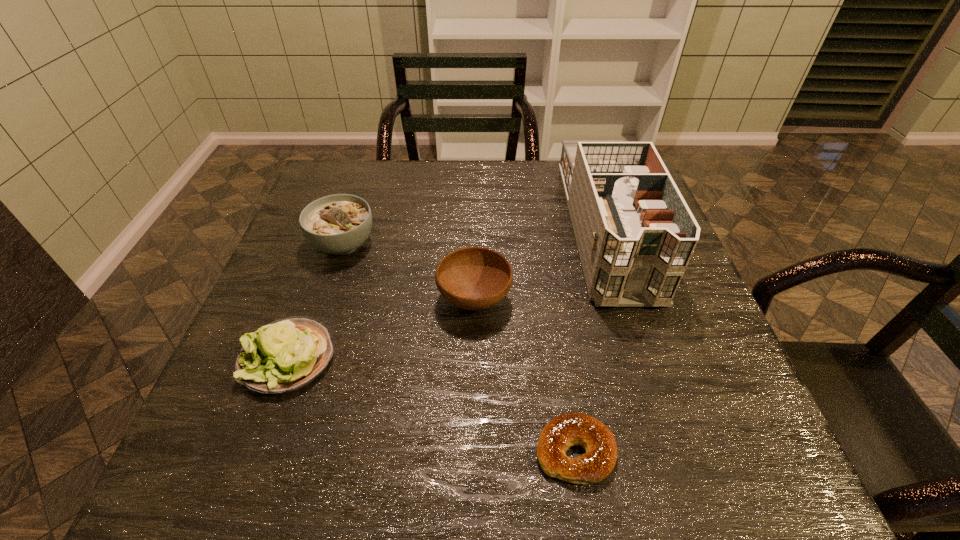
Image resolution: width=960 pixels, height=540 pixels. In order to click on unoccupied area between the tallest object and the fourth object from left to right in this screenshot , I will do `click(590, 340)`.

In order to click on unoccupied position between the soup bowl and the tallest object in this screenshot , I will do `click(474, 236)`.

The height and width of the screenshot is (540, 960). In order to click on free point between the lettuce and the bowl in this screenshot , I will do `click(382, 328)`.

Where is `vacant area that lies between the soup bowl and the bagel`? Image resolution: width=960 pixels, height=540 pixels. vacant area that lies between the soup bowl and the bagel is located at coordinates (459, 347).

Find the location of a particular element. This screenshot has height=540, width=960. object that is the third nearest to the second shortest object is located at coordinates point(570,429).

Point out which object is positioned as the third nearest to the bowl. Please provide its 2D coordinates. Your answer should be formatted as a tuple, i.e. [(x, y)], where the tuple contains the x and y coordinates of a point satisfying the conditions above.

[(285, 355)]

I want to click on vacant area in the image that satisfies the following two spatial constraints: 1. on the back side of the third object from left to right; 2. on the left side of the fourth tallest object, so click(x=310, y=300).

Locate an element on the screen. The image size is (960, 540). vacant space that satisfies the following two spatial constraints: 1. on the front side of the third object from left to right; 2. on the left side of the soup bowl is located at coordinates (324, 300).

The height and width of the screenshot is (540, 960). Find the location of `vacant space that satisfies the following two spatial constraints: 1. on the front side of the bagel; 2. on the right side of the soup bowl`. vacant space that satisfies the following two spatial constraints: 1. on the front side of the bagel; 2. on the right side of the soup bowl is located at coordinates (274, 450).